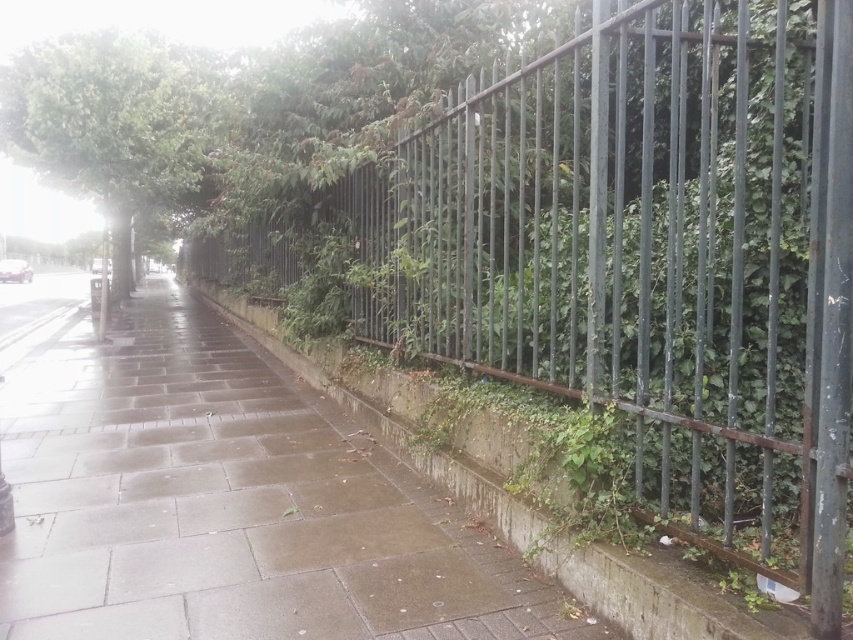
Question: Can you confirm if gray concrete pavement at center is positioned to the left of green leafy tree at upper left?

Choices:
 (A) yes
 (B) no

Answer: (B)

Question: Is gray concrete pavement at center to the right of green leafy tree at upper left from the viewer's perspective?

Choices:
 (A) no
 (B) yes

Answer: (B)

Question: Which point is farther to the camera?

Choices:
 (A) (103, 68)
 (B) (549, 589)

Answer: (A)

Question: Observing the image, what is the correct spatial positioning of gray concrete pavement at center in reference to green leafy tree at upper left?

Choices:
 (A) right
 (B) left

Answer: (A)

Question: Which object is farther from the camera taking this photo?

Choices:
 (A) green leafy tree at upper left
 (B) gray concrete pavement at center

Answer: (A)